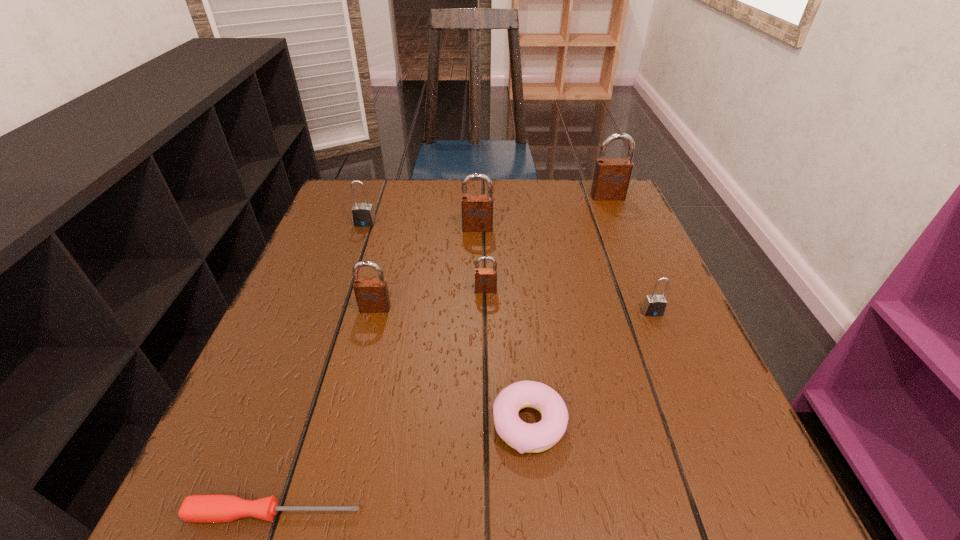
You are a GUI agent. You are given a task and a screenshot of the screen. Output one action in this format:
    pyautogui.click(x=<x>, y=<y>)
    Task: Click on the vacant space at the far edge
    
    Given the screenshot: What is the action you would take?
    pyautogui.click(x=524, y=221)

Image resolution: width=960 pixels, height=540 pixels. I want to click on vacant area at the near edge, so click(540, 477).

In the image, there is a desktop. Where is `vacant space at the left edge`? The width and height of the screenshot is (960, 540). vacant space at the left edge is located at coordinates (331, 347).

Where is `free location at the right edge of the desktop`? The image size is (960, 540). free location at the right edge of the desktop is located at coordinates (631, 380).

Where is `vacant space at the far left corner`? The image size is (960, 540). vacant space at the far left corner is located at coordinates (373, 187).

In the image, there is a desktop. Where is `vacant region at the near right corner`? vacant region at the near right corner is located at coordinates (660, 470).

Locate an element on the screen. vacant space that's between the farther gray padlock and the seventh farthest object is located at coordinates (447, 323).

The width and height of the screenshot is (960, 540). What are the coordinates of `vacant space that is in between the nearest object and the second padlock from left to right` in the screenshot? It's located at (324, 410).

Find the location of a particular element. free space between the left gray padlock and the third nearest padlock is located at coordinates coord(425,256).

You are a GUI agent. You are given a task and a screenshot of the screen. Output one action in this format:
    pyautogui.click(x=<x>, y=<y>)
    Task: Click on the vacant area that lies between the nearer gray padlock and the leftmost padlock
    
    Given the screenshot: What is the action you would take?
    pyautogui.click(x=509, y=268)